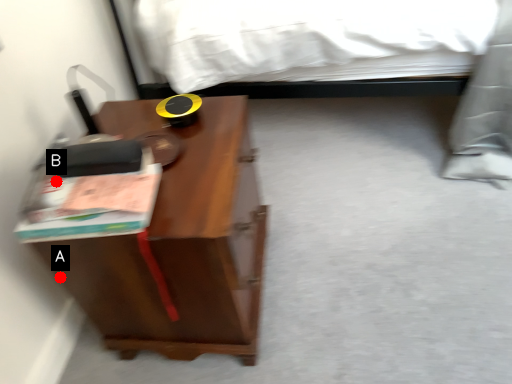
Question: Two points are circled on the image, labeled by A and B beside each circle. Among these points, which one is nearest to the camera?

Choices:
 (A) A is closer
 (B) B is closer

Answer: (B)